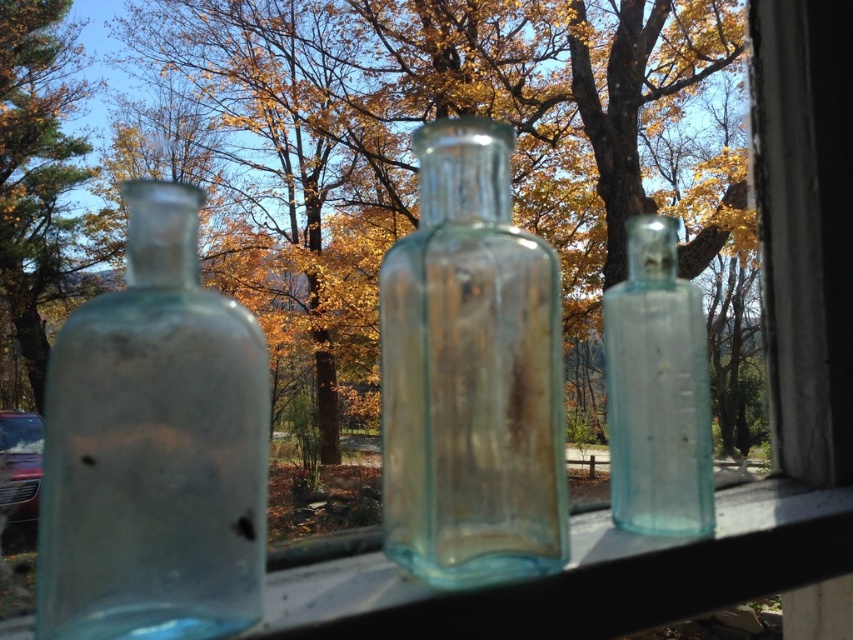
Question: Is translucent glass bottles at center to the right of green leafy tree at left from the viewer's perspective?

Choices:
 (A) no
 (B) yes

Answer: (B)

Question: Which is nearer to the translucent glass bottles at center?

Choices:
 (A) green leafy tree at left
 (B) transparent glass bottle at center

Answer: (A)

Question: Can you confirm if translucent glass bottles at center is smaller than transparent glass bottle at center?

Choices:
 (A) yes
 (B) no

Answer: (B)

Question: Which point is closer to the camera?

Choices:
 (A) pos(683,529)
 (B) pos(45,74)
 (C) pos(171,552)

Answer: (C)

Question: Is transparent glass bottle at left to the left of transparent glass bottle at center from the viewer's perspective?

Choices:
 (A) no
 (B) yes

Answer: (B)

Question: Which of the following is the closest to the observer?

Choices:
 (A) (654, 529)
 (B) (19, 29)

Answer: (A)